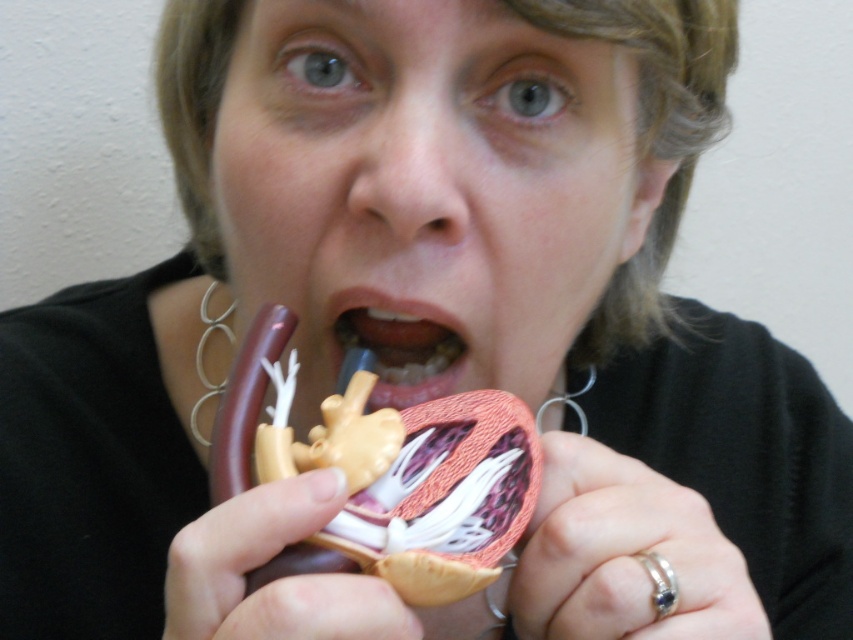
You are a medical student who needs to place both the smooth plastic heart at center and the pink matte heart at center into a storage box that can only accommodate items within 2 inches of each other. Can both hearts fit in the box?

The distance between the smooth plastic heart at center and the pink matte heart at center is 1.87 inches, which is within the 2 inches requirement. Therefore, both hearts can fit into the storage box.

You are a medical student examining two heart models in a lab. You notice the smooth plastic heart at center and the pink matte heart at center. Which one is positioned to the right side of the other?

The smooth plastic heart at center is to the right of the pink matte heart at center.